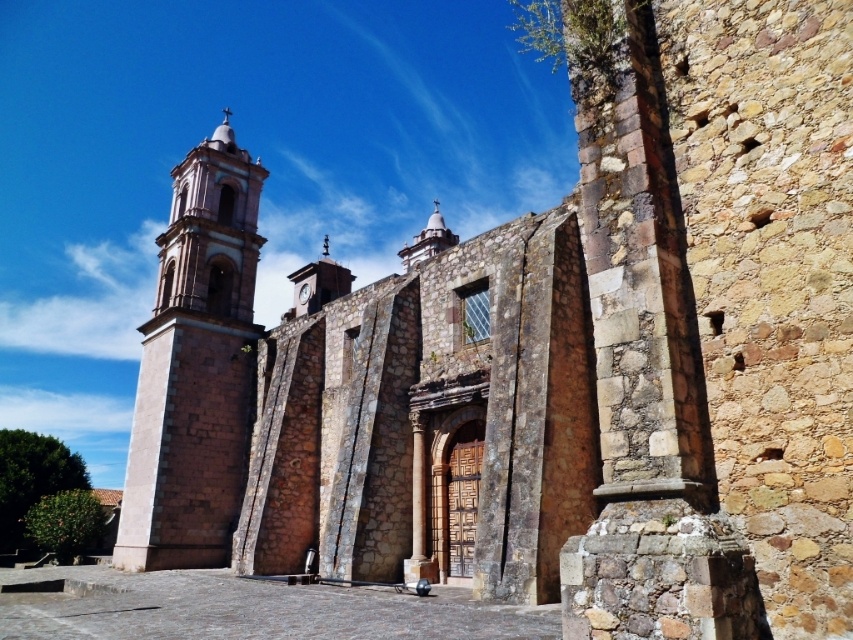
Is smooth stone tower at left shorter than metallic clock face at center?

In fact, smooth stone tower at left may be taller than metallic clock face at center.

Is smooth stone tower at left thinner than metallic clock face at center?

No.

This screenshot has height=640, width=853. In order to click on smooth stone tower at left in this screenshot , I will do `click(195, 368)`.